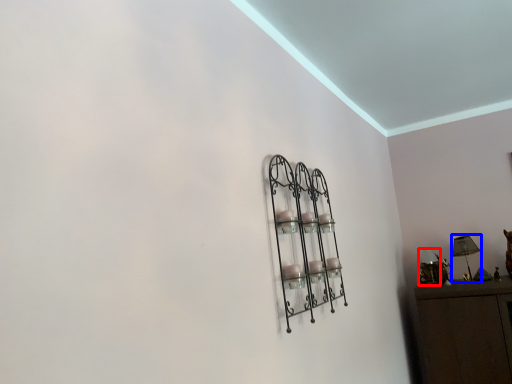
Question: Which object is further to the camera taking this photo, lamp (highlighted by a red box) or table lamp (highlighted by a blue box)?

Choices:
 (A) lamp
 (B) table lamp

Answer: (A)